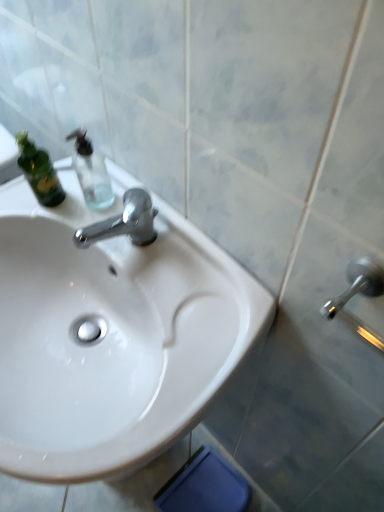
Locate an element on the screen. The image size is (384, 512). free space that is to the left of transparent glass soap dispenser at upper left is located at coordinates click(48, 203).